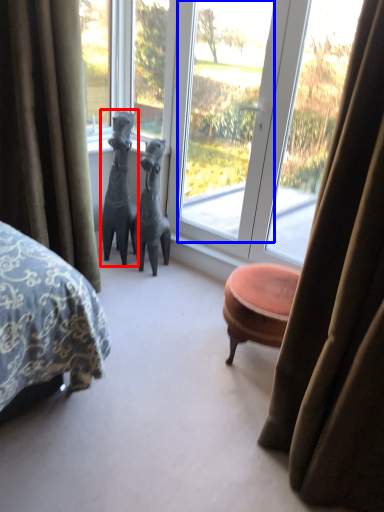
Question: Which object appears farthest to the camera in this image, animal (highlighted by a red box) or window screen (highlighted by a blue box)?

Choices:
 (A) animal
 (B) window screen

Answer: (A)